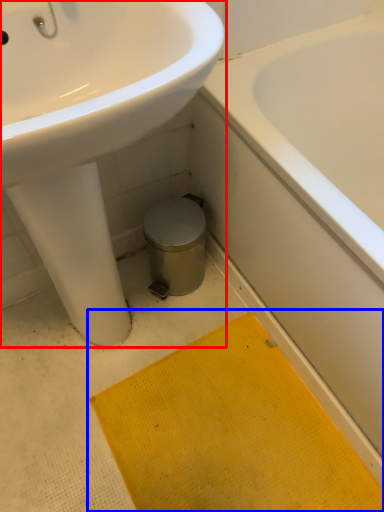
Question: Which point is further to the camera, sink (highlighted by a red box) or bath mat (highlighted by a blue box)?

Choices:
 (A) sink
 (B) bath mat

Answer: (B)